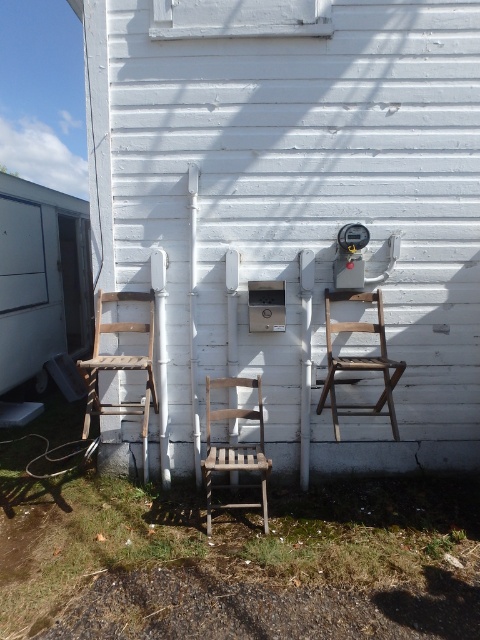
You are standing in front of the building and want to sit on one of the chairs. Which chair, the wooden chair at center or the wooden slatted chair at center, is closer to you?

The wooden chair at center is closer to you because it is further to the viewer than the wooden slatted chair at center, meaning it appears nearer in the image.

You are setting up a small outdoor event and need to arrange two wooden chairs. The wooden chair at center and the wooden chair at left are available. Which chair should you choose if you want the one that takes up more space?

The wooden chair at center is larger in size than the wooden chair at left, so you should choose the wooden chair at center for the one that takes up more space.

You are a delivery person with a box that is 1.5 meters wide. You need to navigate between the wooden chair at center and the wooden chair at left. Can your box fit through the space between them?

The distance between the wooden chair at center and the wooden chair at left is 1.43 meters, which is narrower than the 1.5 meters width of your box. Therefore, the box cannot fit through the space between them.